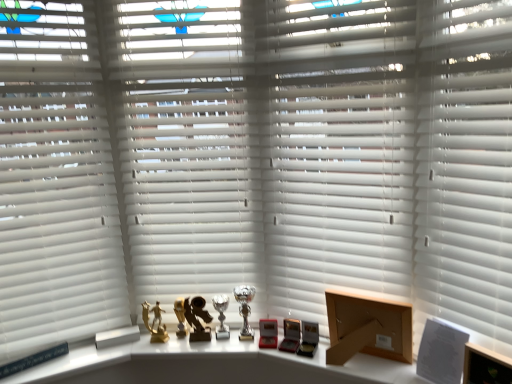
Locate an element on the screen. vacant space to the right of gold metallic figurine at center, which is counted as the second toy, starting from the right is located at coordinates (189, 344).